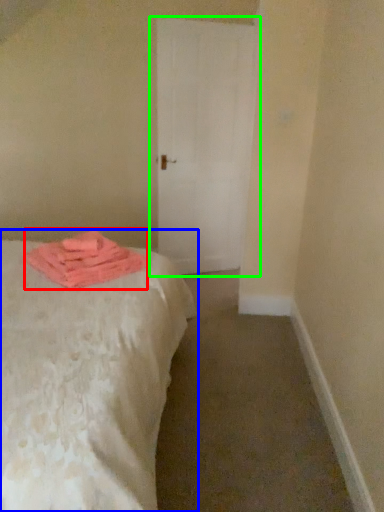
Question: Which object is the farthest from material (highlighted by a red box)? Choose among these: bed (highlighted by a blue box) or door (highlighted by a green box).

Choices:
 (A) bed
 (B) door

Answer: (B)